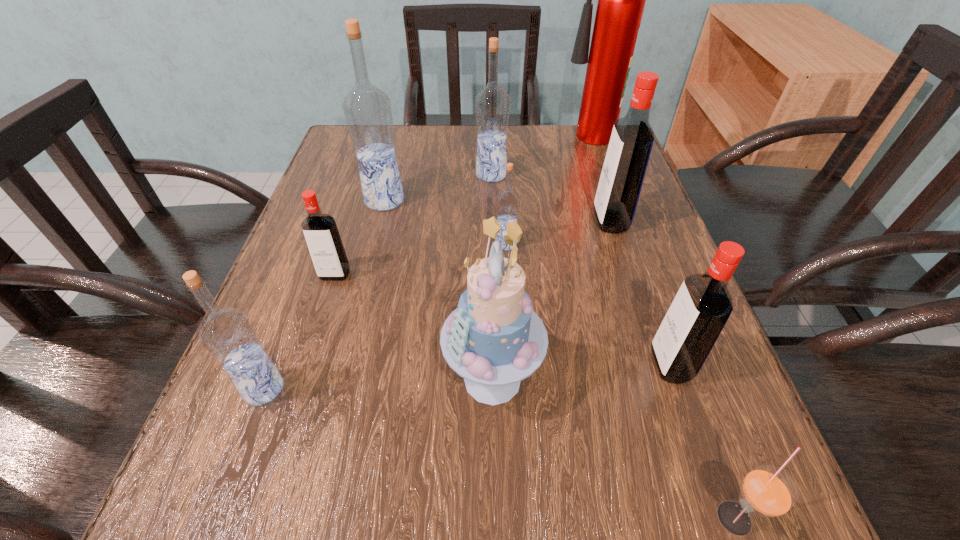
This screenshot has width=960, height=540. In order to click on fire extinguisher in this screenshot , I will do `click(621, 0)`.

Where is `the tallest object`? the tallest object is located at coordinates (621, 0).

I want to click on the ninth shortest object, so click(368, 113).

You are a GUI agent. You are given a task and a screenshot of the screen. Output one action in this format:
    pyautogui.click(x=<x>, y=<y>)
    Task: Click on the biggest blue vodka
    
    Given the screenshot: What is the action you would take?
    pyautogui.click(x=368, y=113)

The image size is (960, 540). Find the location of `the farthest blue vodka`. the farthest blue vodka is located at coordinates (492, 103).

At what (x,y) coordinates should I click in order to perform the action: click on the second biggest blue vodka. Please return your answer as a coordinate pair (x, y). The image size is (960, 540). Looking at the image, I should click on (492, 103).

Locate an element on the screen. the farthest red vodka is located at coordinates (623, 172).

Identify the location of blue cake. The width and height of the screenshot is (960, 540). (494, 339).

The height and width of the screenshot is (540, 960). I want to click on the second smallest red vodka, so pos(703,304).

You are a GUI agent. You are given a task and a screenshot of the screen. Output one action in this format:
    pyautogui.click(x=<x>, y=<y>)
    Task: Click on the nearest blue vodka
    Image resolution: width=960 pixels, height=540 pixels.
    Given the screenshot: What is the action you would take?
    pyautogui.click(x=227, y=334)